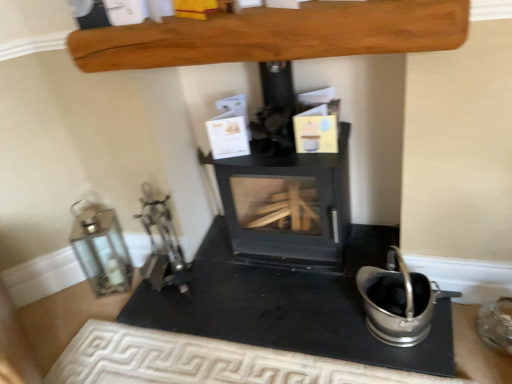
Question: Should I look upward or downward to see black matte wood burning stove at center?

Choices:
 (A) down
 (B) up

Answer: (B)

Question: Could you tell me if smooth wooden beam at upper center is facing satin silver bucket at lower right, acting as the second appliance starting from the right?

Choices:
 (A) no
 (B) yes

Answer: (A)

Question: Considering the relative sizes of smooth wooden beam at upper center and satin silver bucket at lower right, acting as the second appliance starting from the right, in the image provided, is smooth wooden beam at upper center bigger than satin silver bucket at lower right, acting as the second appliance starting from the right,?

Choices:
 (A) yes
 (B) no

Answer: (B)

Question: From a real-world perspective, is smooth wooden beam at upper center below satin silver bucket at lower right, acting as the 2th appliance starting from the left?

Choices:
 (A) yes
 (B) no

Answer: (B)

Question: Is smooth wooden beam at upper center to the right of satin silver bucket at lower right, acting as the 2th appliance starting from the left, from the viewer's perspective?

Choices:
 (A) no
 (B) yes

Answer: (A)

Question: From the image's perspective, does smooth wooden beam at upper center appear lower than satin silver bucket at lower right, acting as the second appliance starting from the right?

Choices:
 (A) yes
 (B) no

Answer: (B)

Question: Can you confirm if smooth wooden beam at upper center is taller than satin silver bucket at lower right, acting as the 2th appliance starting from the left?

Choices:
 (A) no
 (B) yes

Answer: (A)

Question: Considering the relative sizes of transparent glass jar at lower right, the 1th appliance in the right-to-left sequence, and satin silver bucket at lower right, acting as the second appliance starting from the right, in the image provided, is transparent glass jar at lower right, the 1th appliance in the right-to-left sequence, smaller than satin silver bucket at lower right, acting as the second appliance starting from the right,?

Choices:
 (A) yes
 (B) no

Answer: (A)

Question: Is transparent glass jar at lower right, positioned as the third appliance in left-to-right order, at the right side of satin silver bucket at lower right, acting as the second appliance starting from the right?

Choices:
 (A) yes
 (B) no

Answer: (A)

Question: From the image's perspective, is transparent glass jar at lower right, the 1th appliance in the right-to-left sequence, located beneath satin silver bucket at lower right, acting as the 2th appliance starting from the left?

Choices:
 (A) no
 (B) yes

Answer: (B)

Question: Is transparent glass jar at lower right, the 1th appliance in the right-to-left sequence, closer to camera compared to satin silver bucket at lower right, acting as the 2th appliance starting from the left?

Choices:
 (A) no
 (B) yes

Answer: (A)

Question: From the image's perspective, is transparent glass jar at lower right, the 1th appliance in the right-to-left sequence, above satin silver bucket at lower right, acting as the second appliance starting from the right?

Choices:
 (A) no
 (B) yes

Answer: (A)

Question: Is transparent glass jar at lower right, positioned as the third appliance in left-to-right order, outside satin silver bucket at lower right, acting as the 2th appliance starting from the left?

Choices:
 (A) no
 (B) yes

Answer: (B)

Question: Is black matte wood burning stove at center shorter than satin silver bucket at lower right, acting as the second appliance starting from the right?

Choices:
 (A) yes
 (B) no

Answer: (B)